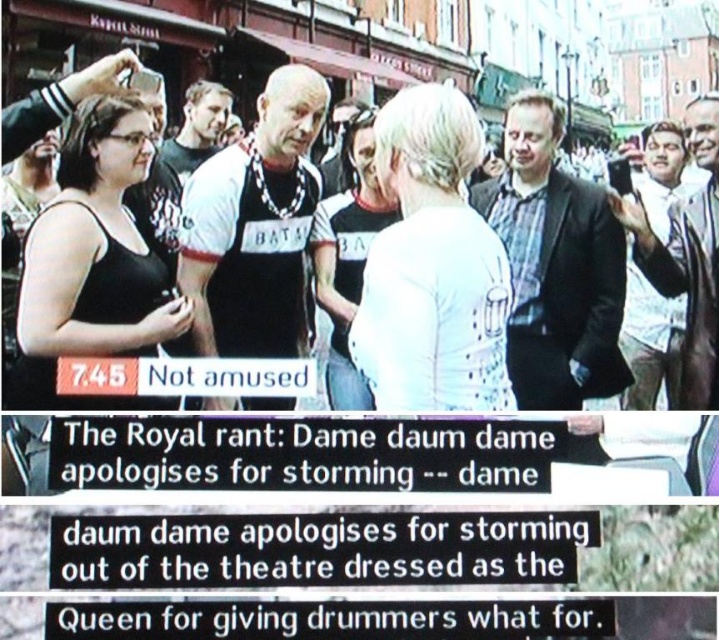
You are a fashion designer analyzing this image for a new collection. You notice the black matte tank top at left and the black fabric crowd at center. Which of these two items is visually less prominent in the image?

The black matte tank top at left is smaller than the black fabric crowd at center, making it less prominent.